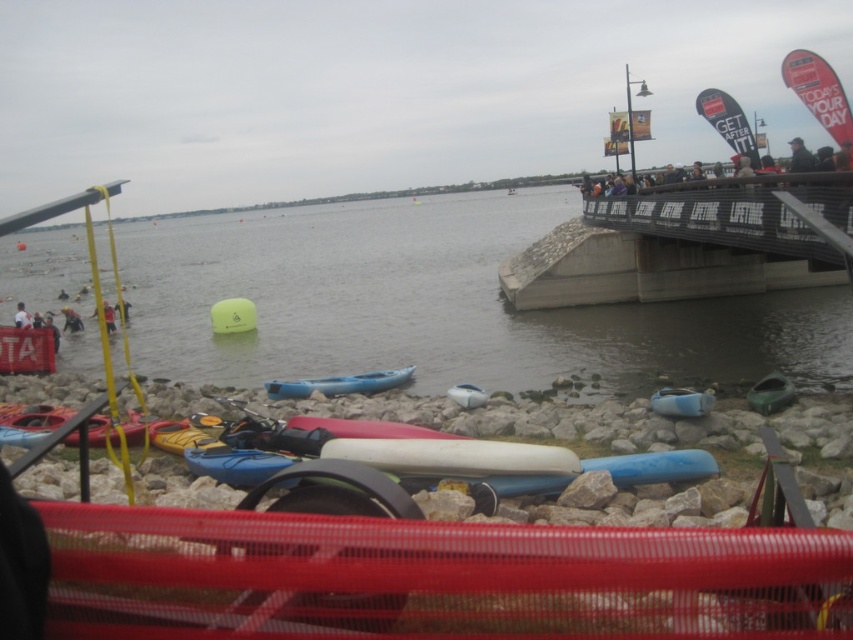
You are standing at the edge of the waterfront scene and notice both the clear water at lower left and the white fabric person at lower left. Which object is closer to you?

The clear water at lower left is closer to you since it is in front of the white fabric person at lower left.

Looking at this image, you are a photographer trying to capture the blue rubber boat at center without the red mesh netting at lower center blocking the view. Given their sizes, can you position yourself so that the boat is fully visible while the netting is mostly out of frame?

The red mesh netting at lower center is wider than the blue rubber boat at center. To ensure the boat is fully visible while minimizing the netting in the frame, position yourself so that the boat is centered and the netting is partially or mostly out of the shot due to its greater width.